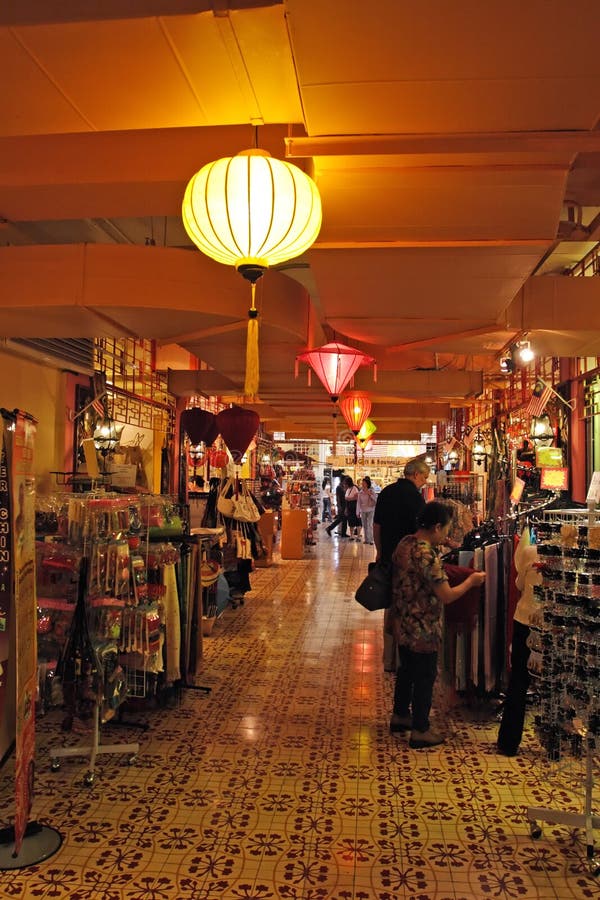
Where is `orange lantern`? Image resolution: width=600 pixels, height=900 pixels. orange lantern is located at coordinates pos(348,414).